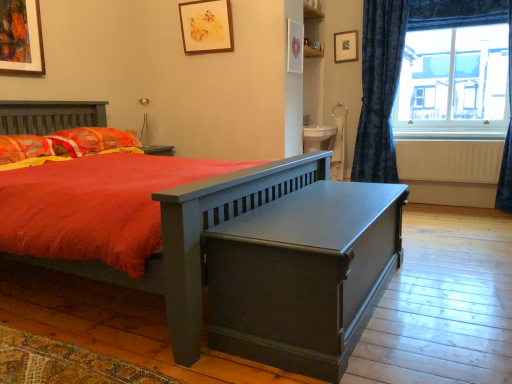
This screenshot has width=512, height=384. What do you see at coordinates (455, 79) in the screenshot?
I see `transparent glass window at upper right` at bounding box center [455, 79].

What is the approximate width of blue fabric curtain at right, which is the first curtain in right-to-left order?

blue fabric curtain at right, which is the first curtain in right-to-left order, is 28.25 centimeters in width.

Identify the location of blue fabric curtain at right, the 2th curtain in the left-to-right sequence. coord(507,143).

The width and height of the screenshot is (512, 384). Describe the element at coordinates (206, 26) in the screenshot. I see `wooden picture frame at upper center, which is the second picture frame from back to front` at that location.

Find the location of `matte wooden picture frame at upper left, which is the 1th picture frame from left to right`. matte wooden picture frame at upper left, which is the 1th picture frame from left to right is located at coordinates (21, 37).

Measure the distance between point (130, 135) and camera.

Point (130, 135) is 11.77 feet from camera.

Image resolution: width=512 pixels, height=384 pixels. What do you see at coordinates (303, 275) in the screenshot?
I see `matte dark green trunk at center` at bounding box center [303, 275].

Describe the element at coordinates (379, 89) in the screenshot. I see `blue textured curtain at right, which is the 1th curtain from left to right` at that location.

Identify the location of transparent glass window at upper right. (455, 79).

From a real-world perspective, between blue fabric curtain at right, which is the first curtain in right-to-left order, and blue textured curtain at right, which is the 1th curtain from left to right, who is vertically higher?

In real-world perspective, blue textured curtain at right, which is the 1th curtain from left to right, is above.

Between blue fabric curtain at right, which is the first curtain in right-to-left order, and blue textured curtain at right, which is the 1th curtain from left to right, which one has smaller size?

Smaller between the two is blue fabric curtain at right, which is the first curtain in right-to-left order.

From the image's perspective, which one is positioned lower, blue fabric curtain at right, which is the first curtain in right-to-left order, or blue textured curtain at right, which is the 1th curtain from left to right?

blue fabric curtain at right, which is the first curtain in right-to-left order, from the image's perspective.

What's the angular difference between blue fabric curtain at right, which is the first curtain in right-to-left order, and blue textured curtain at right, which is the 1th curtain from left to right,'s facing directions?

The facing directions of blue fabric curtain at right, which is the first curtain in right-to-left order, and blue textured curtain at right, which is the 1th curtain from left to right, are 0.405 degrees apart.

I want to click on window on the right of matte white picture frame at upper center, marked as the 2th picture frame in a right-to-left arrangement, so click(455, 79).

Is matte white picture frame at upper center, marked as the 2th picture frame in a right-to-left arrangement, further to the viewer compared to transparent glass window at upper right?

No, matte white picture frame at upper center, marked as the 2th picture frame in a right-to-left arrangement, is in front of transparent glass window at upper right.

Does matte white picture frame at upper center, which is counted as the third picture frame, starting from the back, have a greater height compared to transparent glass window at upper right?

No, matte white picture frame at upper center, which is counted as the third picture frame, starting from the back, is not taller than transparent glass window at upper right.

From the image's perspective, between floral fabric pillow at left, which is counted as the 1th pillow, starting from the back, and matte wooden picture frame at upper center, positioned as the fourth picture frame in left-to-right order, which one is located above?

From the image's view, matte wooden picture frame at upper center, positioned as the fourth picture frame in left-to-right order, is above.

Locate an element on the screen. the 1st pillow positioned below the matte wooden picture frame at upper center, the 1th picture frame viewed from the back (from the image's perspective) is located at coordinates (89, 141).

Looking at this image, would you consider floral fabric pillow at left, which is counted as the 1th pillow, starting from the back, to be distant from matte wooden picture frame at upper center, which appears as the 1th picture frame when viewed from the right?

floral fabric pillow at left, which is counted as the 1th pillow, starting from the back, is far away from matte wooden picture frame at upper center, which appears as the 1th picture frame when viewed from the right.

From a real-world perspective, is matte wooden picture frame at upper center, which ranks as the 4th picture frame in front-to-back order, located beneath blue fabric curtain at right, which is the first curtain in right-to-left order?

Actually, matte wooden picture frame at upper center, which ranks as the 4th picture frame in front-to-back order, is physically above blue fabric curtain at right, which is the first curtain in right-to-left order, in the real world.

Can you confirm if matte wooden picture frame at upper center, the 1th picture frame viewed from the back, is shorter than blue fabric curtain at right, the 2th curtain in the left-to-right sequence?

Yes.

Who is smaller, matte wooden picture frame at upper center, positioned as the fourth picture frame in left-to-right order, or blue fabric curtain at right, the 2th curtain in the left-to-right sequence?

matte wooden picture frame at upper center, positioned as the fourth picture frame in left-to-right order, is smaller.

Is point (351, 43) closer or farther from the camera than point (246, 213)?

Point (351, 43) is farther from the camera than point (246, 213).

Between matte wooden picture frame at upper center, the 1th picture frame viewed from the back, and matte dark green trunk at center, which one has larger width?

Wider between the two is matte dark green trunk at center.

Who is bigger, matte wooden picture frame at upper center, positioned as the fourth picture frame in left-to-right order, or matte dark green trunk at center?

Bigger between the two is matte dark green trunk at center.

Considering the points (117, 143) and (195, 34), which point is behind, point (117, 143) or point (195, 34)?

The point (195, 34) is farther from the camera.

Which object is positioned more to the left, floral fabric pillow at left, marked as the 2th pillow in a front-to-back arrangement, or wooden picture frame at upper center, the 2th picture frame when ordered from left to right?

floral fabric pillow at left, marked as the 2th pillow in a front-to-back arrangement.

Is floral fabric pillow at left, marked as the 2th pillow in a front-to-back arrangement, positioned in front of wooden picture frame at upper center, the 2th picture frame when ordered from left to right?

Yes, it is in front of wooden picture frame at upper center, the 2th picture frame when ordered from left to right.

Who is bigger, floral fabric pillow at left, marked as the 2th pillow in a front-to-back arrangement, or wooden picture frame at upper center, the 2th picture frame when ordered from left to right?

Bigger between the two is floral fabric pillow at left, marked as the 2th pillow in a front-to-back arrangement.

Could you tell me if fluffy orange pillow at left, which appears as the 2th pillow when viewed from the back, is turned towards blue fabric curtain at right, the 2th curtain in the left-to-right sequence?

No, fluffy orange pillow at left, which appears as the 2th pillow when viewed from the back, is not turned towards blue fabric curtain at right, the 2th curtain in the left-to-right sequence.

Is fluffy orange pillow at left, which appears as the 2th pillow when viewed from the back, positioned behind blue fabric curtain at right, which is the first curtain in right-to-left order?

No, it is in front of blue fabric curtain at right, which is the first curtain in right-to-left order.

Which is more to the right, fluffy orange pillow at left, which appears as the 2th pillow when viewed from the back, or blue fabric curtain at right, which is the first curtain in right-to-left order?

blue fabric curtain at right, which is the first curtain in right-to-left order.

The image size is (512, 384). There is a blue fabric curtain at right, the 2th curtain in the left-to-right sequence. Identify the location of curtain above it (from a real-world perspective). (379, 89).

Locate an element on the screen. Image resolution: width=512 pixels, height=384 pixels. window that is under the matte white picture frame at upper center, which is counted as the third picture frame, starting from the left (from a real-world perspective) is located at coordinates (455, 79).

Based on their spatial positions, is fluffy orange pillow at left, which appears as the 2th pillow when viewed from the back, or blue fabric curtain at right, which is the first curtain in right-to-left order, further from transparent glass window at upper right?

fluffy orange pillow at left, which appears as the 2th pillow when viewed from the back.

Considering their positions, is matte white picture frame at upper center, which is counted as the third picture frame, starting from the back, positioned closer to blue textured curtain at right, which is the 1th curtain from left to right, than fluffy orange pillow at left, which ranks as the first pillow in front-to-back order?

matte white picture frame at upper center, which is counted as the third picture frame, starting from the back, is closer to blue textured curtain at right, which is the 1th curtain from left to right.

Considering their positions, is wooden picture frame at upper center, placed as the third picture frame when sorted from front to back, positioned further to fluffy orange pillow at left, which ranks as the first pillow in front-to-back order, than blue fabric curtain at right, which is the first curtain in right-to-left order?

The object further to fluffy orange pillow at left, which ranks as the first pillow in front-to-back order, is blue fabric curtain at right, which is the first curtain in right-to-left order.

Estimate the real-world distances between objects in this image. Which object is closer to white matte radiator at right, matte dark green trunk at center or floral fabric pillow at left, which is counted as the 1th pillow, starting from the back?

Based on the image, matte dark green trunk at center appears to be nearer to white matte radiator at right.

Considering their positions, is white matte radiator at right positioned closer to matte wooden picture frame at upper center, positioned as the fourth picture frame in left-to-right order, than wooden picture frame at upper center, the 2th picture frame when ordered from left to right?

Based on the image, wooden picture frame at upper center, the 2th picture frame when ordered from left to right, appears to be nearer to matte wooden picture frame at upper center, positioned as the fourth picture frame in left-to-right order.

Which object lies nearer to the anchor point white matte radiator at right, floral fabric pillow at left, which is counted as the 1th pillow, starting from the back, or fluffy orange pillow at left, which appears as the 2th pillow when viewed from the back?

floral fabric pillow at left, which is counted as the 1th pillow, starting from the back.

Based on their spatial positions, is blue fabric curtain at right, the 2th curtain in the left-to-right sequence, or matte wooden picture frame at upper left, marked as the fourth picture frame in a back-to-front arrangement, further from matte dark green trunk at center?

Based on the image, matte wooden picture frame at upper left, marked as the fourth picture frame in a back-to-front arrangement, appears to be further to matte dark green trunk at center.

Based on their spatial positions, is matte wooden picture frame at upper center, which ranks as the 4th picture frame in front-to-back order, or fluffy orange pillow at left, which appears as the 2th pillow when viewed from the back, closer to wooden picture frame at upper center, the 2th picture frame when ordered from left to right?

Among the two, matte wooden picture frame at upper center, which ranks as the 4th picture frame in front-to-back order, is located nearer to wooden picture frame at upper center, the 2th picture frame when ordered from left to right.

Where is `pillow between fluffy orange pillow at left, which appears as the 2th pillow when viewed from the back, and matte wooden picture frame at upper center, which ranks as the 4th picture frame in front-to-back order, from left to right`? Image resolution: width=512 pixels, height=384 pixels. pillow between fluffy orange pillow at left, which appears as the 2th pillow when viewed from the back, and matte wooden picture frame at upper center, which ranks as the 4th picture frame in front-to-back order, from left to right is located at coordinates [x=89, y=141].

I want to click on curtain between matte dark green trunk at center and white matte radiator at right from front to back, so click(x=507, y=143).

Locate an element on the screen. The height and width of the screenshot is (384, 512). curtain situated between wooden picture frame at upper center, which is the second picture frame from back to front, and transparent glass window at upper right from left to right is located at coordinates (379, 89).

Locate an element on the screen. The height and width of the screenshot is (384, 512). radiator between fluffy orange pillow at left, which ranks as the first pillow in front-to-back order, and blue fabric curtain at right, which is the first curtain in right-to-left order, in the horizontal direction is located at coordinates (449, 161).